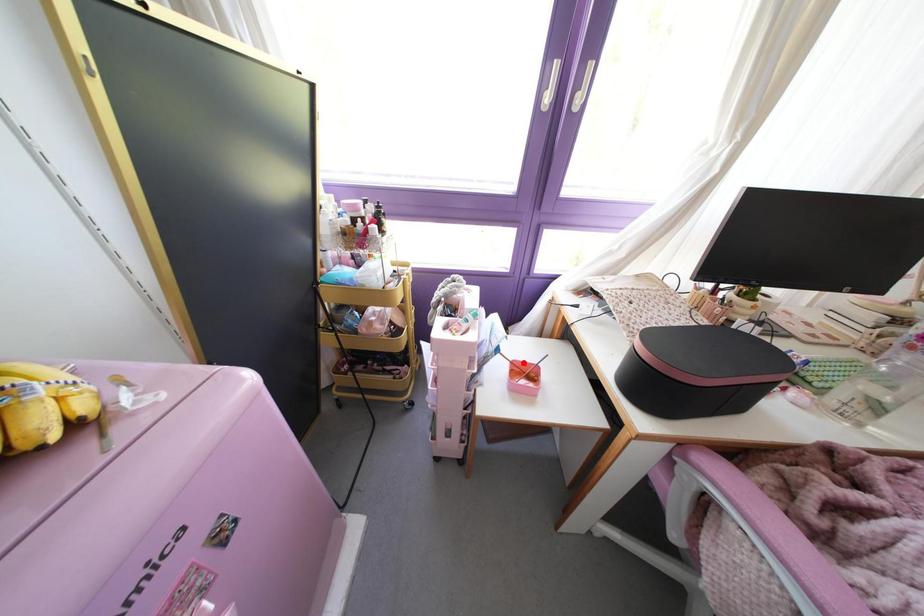
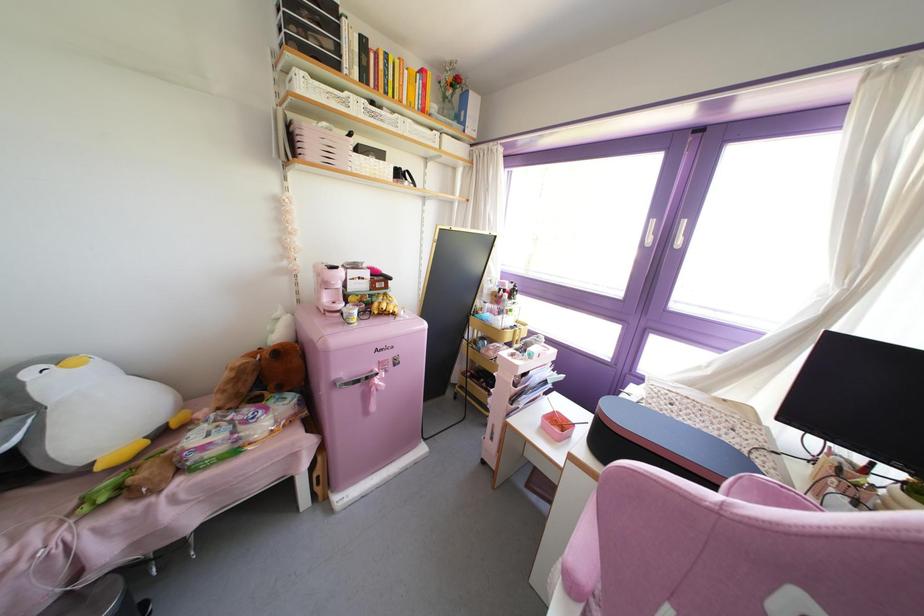
In the second image, find the point that corresponds to the highlighted location in the first image.

(565, 418)